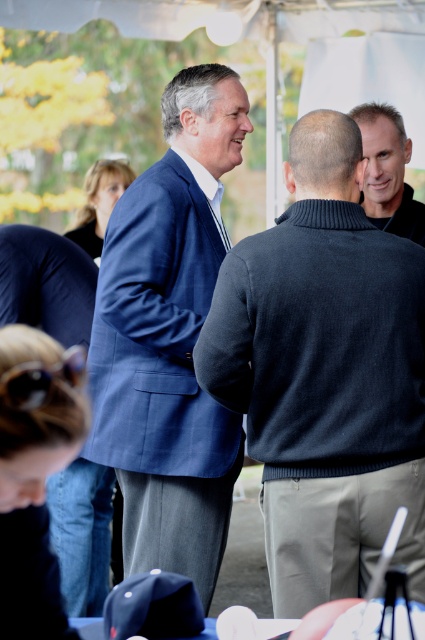
You are organizing a charity event and need to arrange seating based on the guests clothing. You see the blue woolen suit at center and the smooth gray sweater at upper right. Which clothing item belongs to a guest who requires a larger chair size?

The blue woolen suit at center requires a larger chair size because it has a larger size compared to the smooth gray sweater at upper right.

You are at an outdoor event under a white canopy tent. You see two blue suits at the center of the scene. One is labeled as a blue wool suit at center and the other as a blue woolen suit at center. Which one is positioned lower in the image?

The blue wool suit at center is located below the blue woolen suit at center, so the blue wool suit at center is positioned lower in the image.

You are a photographer at the event and need to capture a group photo. The blue wool suit at center and the smooth gray sweater at upper right are in your frame. Which person should you adjust to ensure both are fully visible in the photo?

Since the blue wool suit at center is taller than the smooth gray sweater at upper right, you should lower the camera angle slightly to accommodate the height of the blue wool suit at center while keeping the smooth gray sweater at upper right in frame.